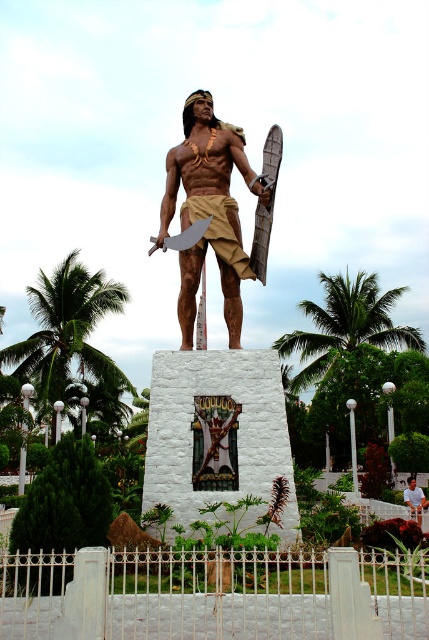
Does brown polished wood statue at center have a lesser width compared to light brown wood statue at center?

No, brown polished wood statue at center is not thinner than light brown wood statue at center.

Does brown polished wood statue at center have a lesser height compared to light brown wood statue at center?

No.

Is point (187, 144) closer to viewer compared to point (419, 500)?

Yes, it is in front of point (419, 500).

In order to click on brown polished wood statue at center in this screenshot , I will do `click(208, 209)`.

Is brown polished wood statue at center smaller than wooden figure at center?

Incorrect, brown polished wood statue at center is not smaller in size than wooden figure at center.

Can you confirm if brown polished wood statue at center is positioned to the left of wooden figure at center?

Yes, brown polished wood statue at center is to the left of wooden figure at center.

Where is `brown polished wood statue at center`? brown polished wood statue at center is located at coordinates (208, 209).

Can you confirm if wooden figure at center is smaller than light brown wood statue at center?

Yes, wooden figure at center is smaller than light brown wood statue at center.

Does wooden figure at center have a greater height compared to light brown wood statue at center?

No.

I want to click on wooden figure at center, so click(214, 442).

This screenshot has width=429, height=640. Find the location of `wooden figure at center`. wooden figure at center is located at coordinates (214, 442).